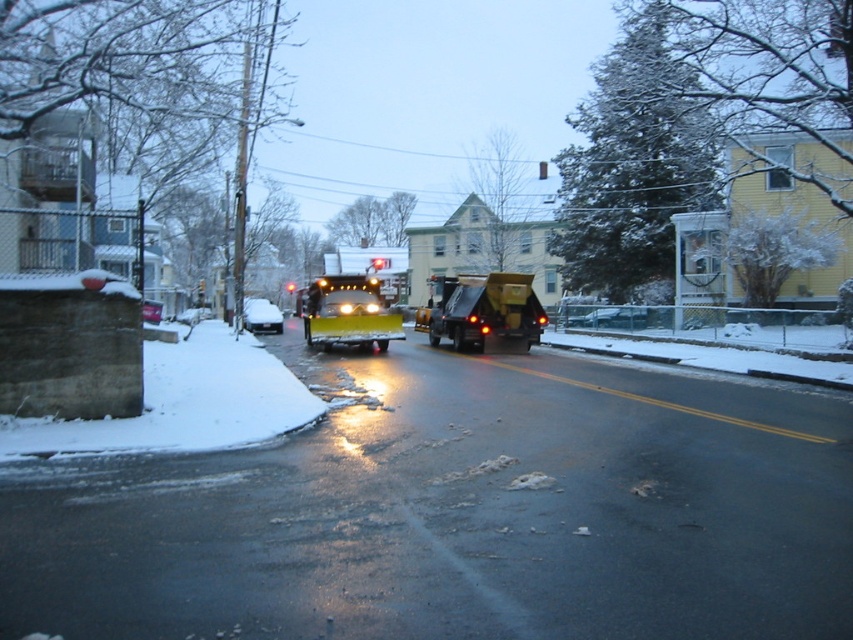
You are a pedestrian trying to cross the street safely. You see the yellow rubber snowplow at center and the metallic silver sedan at center. Which vehicle is closer to you, and should you be cautious of it first?

The yellow rubber snowplow at center is closer to you than the metallic silver sedan at center. You should be cautious of the yellow rubber snowplow at center first because it is nearer to your position as a pedestrian.

You are a delivery driver who needs to drive a truck through the street shown. The truck has a height restriction of 2 meters. Can you safely pass under the yellow rubber snowplow at center and the white matte car at center without hitting the vehicles?

The yellow rubber snowplow at center is taller than the white matte car at center. Since the snowplow is higher, if the snowplow is below the truck, the truck might not pass. However, the question is about passing under both vehicles. Wait, but the snowplow and car are on the road, so the truck would be passing by them, not under. Maybe the question is about height clearance under a bridge or something else? The scene description mentions the snowplow is at center and the car is also at center. Maybe theyre